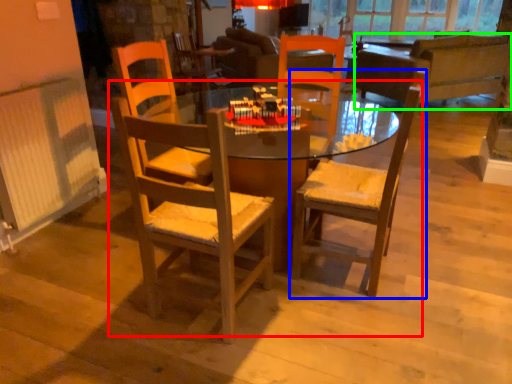
Question: Considering the real-world distances, which object is farthest from kitchen & dining room table (highlighted by a red box)? chair (highlighted by a blue box) or studio couch (highlighted by a green box)?

Choices:
 (A) chair
 (B) studio couch

Answer: (B)